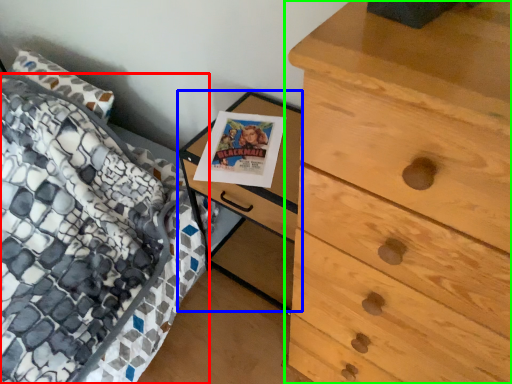
Question: Which object is the closest to the bed (highlighted by a red box)? Choose among these: nightstand (highlighted by a blue box) or chest of drawers (highlighted by a green box).

Choices:
 (A) nightstand
 (B) chest of drawers

Answer: (A)